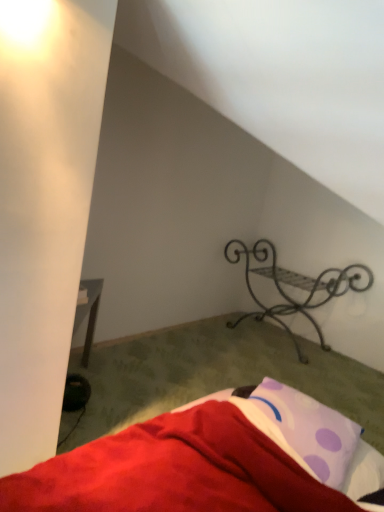
Question: Is red soft fabric bed at lower right surrounding black wrought iron shelf at upper right?

Choices:
 (A) no
 (B) yes

Answer: (A)

Question: Is red soft fabric bed at lower right thinner than black wrought iron shelf at upper right?

Choices:
 (A) yes
 (B) no

Answer: (B)

Question: Would you consider red soft fabric bed at lower right to be distant from black wrought iron shelf at upper right?

Choices:
 (A) no
 (B) yes

Answer: (B)

Question: Is red soft fabric bed at lower right facing away from black wrought iron shelf at upper right?

Choices:
 (A) yes
 (B) no

Answer: (B)

Question: Is red soft fabric bed at lower right facing towards black wrought iron shelf at upper right?

Choices:
 (A) yes
 (B) no

Answer: (B)

Question: In terms of height, does purple dotted pillow at lower right look taller or shorter compared to red soft fabric bed at lower right?

Choices:
 (A) tall
 (B) short

Answer: (A)

Question: Is purple dotted pillow at lower right bigger or smaller than red soft fabric bed at lower right?

Choices:
 (A) big
 (B) small

Answer: (B)

Question: Considering the positions of purple dotted pillow at lower right and red soft fabric bed at lower right in the image, is purple dotted pillow at lower right wider or thinner than red soft fabric bed at lower right?

Choices:
 (A) wide
 (B) thin

Answer: (B)

Question: Considering their positions, is purple dotted pillow at lower right located in front of or behind red soft fabric bed at lower right?

Choices:
 (A) front
 (B) behind

Answer: (B)

Question: Do you think black wrought iron shelf at upper right is within red soft fabric bed at lower right, or outside of it?

Choices:
 (A) outside
 (B) inside

Answer: (A)

Question: Based on their positions, is black wrought iron shelf at upper right located to the left or right of red soft fabric bed at lower right?

Choices:
 (A) left
 (B) right

Answer: (B)

Question: In the image, is black wrought iron shelf at upper right positioned in front of or behind red soft fabric bed at lower right?

Choices:
 (A) front
 (B) behind

Answer: (B)

Question: From their relative heights in the image, would you say black wrought iron shelf at upper right is taller or shorter than red soft fabric bed at lower right?

Choices:
 (A) short
 (B) tall

Answer: (B)

Question: From a real-world perspective, relative to purple dotted pillow at lower right, is black wrought iron shelf at upper right vertically above or below?

Choices:
 (A) above
 (B) below

Answer: (B)

Question: In terms of height, does black wrought iron shelf at upper right look taller or shorter compared to purple dotted pillow at lower right?

Choices:
 (A) short
 (B) tall

Answer: (B)